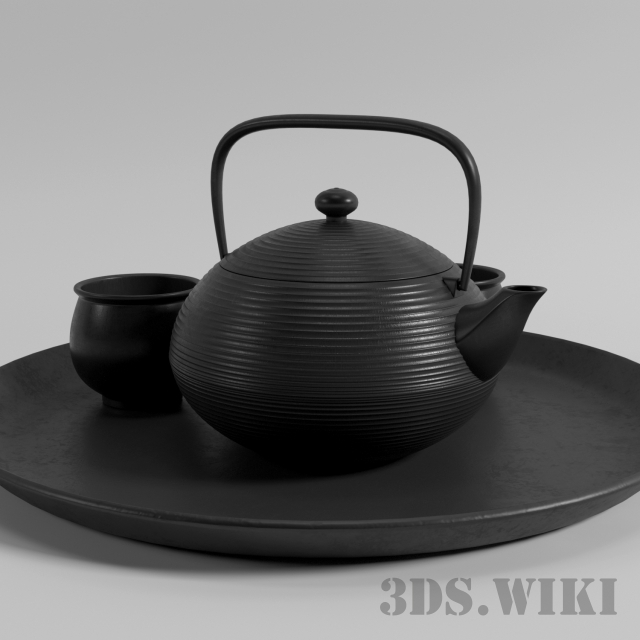
At what (x,y) coordinates should I click in order to perform the action: click on spout of kettle. Please return your answer as a coordinate pair (x, y). This screenshot has height=640, width=640. Looking at the image, I should click on (529, 294).